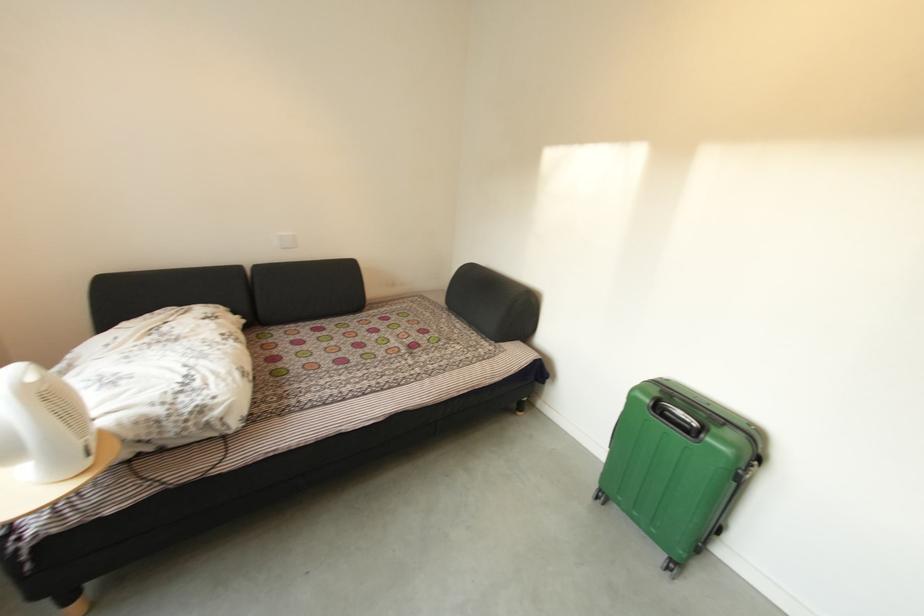
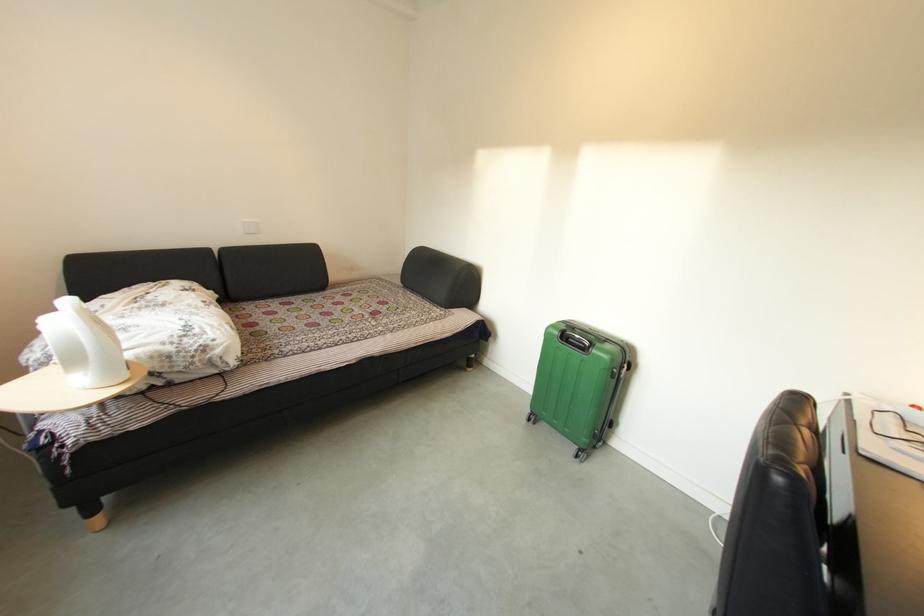
Question: The images are taken continuously from a first-person perspective. In which direction is your viewpoint rotating?

Choices:
 (A) Left
 (B) Right
 (C) Up
 (D) Down

Answer: (B)